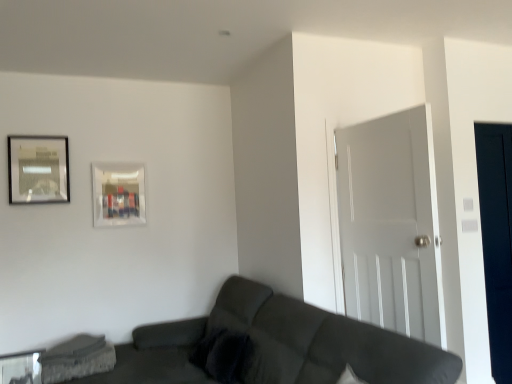
Describe the element at coordinates (21, 368) in the screenshot. I see `transparent glass table at lower left` at that location.

What do you see at coordinates (118, 194) in the screenshot? I see `matte glass picture frame at upper center, acting as the 2th picture frame starting from the front` at bounding box center [118, 194].

Locate an element on the screen. The height and width of the screenshot is (384, 512). white matte door at right is located at coordinates (391, 224).

Is transparent glass table at lower left located outside velvety dark gray pillow at lower center?

Yes, transparent glass table at lower left is not within velvety dark gray pillow at lower center.

Is transparent glass table at lower left oriented towards velvety dark gray pillow at lower center?

No, transparent glass table at lower left does not turn towards velvety dark gray pillow at lower center.

Find the location of `pillow lying above the transparent glass table at lower left (from the image's perspective)`. pillow lying above the transparent glass table at lower left (from the image's perspective) is located at coordinates (227, 355).

How far apart are transparent glass table at lower left and velvety dark gray pillow at lower center?

4.21 feet.

Locate an element on the screen. door in front of the velvety dark gray pillow at lower center is located at coordinates (391, 224).

Considering the points (239, 367) and (345, 176), which point is in front, point (239, 367) or point (345, 176)?

Positioned in front is point (239, 367).

Is velvety dark gray pillow at lower center far away from white matte door at right?

Indeed, velvety dark gray pillow at lower center is not near white matte door at right.

Between velvety dark gray pillow at lower center and white matte door at right, which one appears on the right side from the viewer's perspective?

Positioned to the right is white matte door at right.

Based on the photo, which object is closer to the camera, matte glass picture frame at upper center, placed as the 1th picture frame when sorted from right to left, or dark gray fabric couch at lower center?

dark gray fabric couch at lower center is in front.

Which object is wider, matte glass picture frame at upper center, placed as the 1th picture frame when sorted from back to front, or dark gray fabric couch at lower center?

dark gray fabric couch at lower center.

Is dark gray fabric couch at lower center surrounded by matte glass picture frame at upper center, acting as the 2th picture frame starting from the front?

That's incorrect, dark gray fabric couch at lower center is not inside matte glass picture frame at upper center, acting as the 2th picture frame starting from the front.

Measure the distance from matte glass picture frame at upper center, placed as the 1th picture frame when sorted from back to front, to dark gray fabric couch at lower center.

matte glass picture frame at upper center, placed as the 1th picture frame when sorted from back to front, and dark gray fabric couch at lower center are 4.57 feet apart.

Considering the positions of points (58, 380) and (6, 373), is point (58, 380) farther from camera compared to point (6, 373)?

No, (58, 380) is closer to viewer.

Could you tell me if concrete textured swivel chair at lower left is turned towards transparent glass table at lower left?

No, concrete textured swivel chair at lower left is not turned towards transparent glass table at lower left.

Considering the positions of objects concrete textured swivel chair at lower left and transparent glass table at lower left in the image provided, who is more to the left, concrete textured swivel chair at lower left or transparent glass table at lower left?

Positioned to the left is transparent glass table at lower left.

Are concrete textured swivel chair at lower left and transparent glass table at lower left located far from each other?

Result: That's not correct — concrete textured swivel chair at lower left is a little close to transparent glass table at lower left.

Considering the relative sizes of matte glass picture frame at upper center, placed as the 1th picture frame when sorted from back to front, and metallic silver picture frame at upper left, placed as the 2th picture frame when sorted from right to left, in the image provided, is matte glass picture frame at upper center, placed as the 1th picture frame when sorted from back to front, wider than metallic silver picture frame at upper left, placed as the 2th picture frame when sorted from right to left,?

In fact, matte glass picture frame at upper center, placed as the 1th picture frame when sorted from back to front, might be narrower than metallic silver picture frame at upper left, placed as the 2th picture frame when sorted from right to left.

In terms of height, does matte glass picture frame at upper center, placed as the 1th picture frame when sorted from back to front, look taller or shorter compared to metallic silver picture frame at upper left, placed as the 2th picture frame when sorted from right to left?

In the image, matte glass picture frame at upper center, placed as the 1th picture frame when sorted from back to front, appears to be shorter than metallic silver picture frame at upper left, placed as the 2th picture frame when sorted from right to left.

Is matte glass picture frame at upper center, marked as the 2th picture frame in a left-to-right arrangement, surrounding metallic silver picture frame at upper left, marked as the 2th picture frame in a back-to-front arrangement?

No, metallic silver picture frame at upper left, marked as the 2th picture frame in a back-to-front arrangement, is not inside matte glass picture frame at upper center, marked as the 2th picture frame in a left-to-right arrangement.

Considering their positions, is matte glass picture frame at upper center, placed as the 1th picture frame when sorted from back to front, located in front of or behind metallic silver picture frame at upper left, placed as the 2th picture frame when sorted from right to left?

Visually, matte glass picture frame at upper center, placed as the 1th picture frame when sorted from back to front, is located behind metallic silver picture frame at upper left, placed as the 2th picture frame when sorted from right to left.

The image size is (512, 384). Identify the location of swivel chair on the left side of matte glass picture frame at upper center, marked as the 2th picture frame in a left-to-right arrangement. (77, 358).

Is concrete textured swivel chair at lower left in front of or behind matte glass picture frame at upper center, acting as the 2th picture frame starting from the front, in the image?

concrete textured swivel chair at lower left is in front of matte glass picture frame at upper center, acting as the 2th picture frame starting from the front.

Does point (100, 356) lie in front of point (114, 216)?

Yes, it is.

Is there a large distance between concrete textured swivel chair at lower left and matte glass picture frame at upper center, placed as the 1th picture frame when sorted from right to left?

Yes, concrete textured swivel chair at lower left and matte glass picture frame at upper center, placed as the 1th picture frame when sorted from right to left, are quite far apart.

Is concrete textured swivel chair at lower left oriented away from white matte door at right?

No, concrete textured swivel chair at lower left's orientation is not away from white matte door at right.

Is concrete textured swivel chair at lower left at the right side of white matte door at right?

No.

Is there a large distance between concrete textured swivel chair at lower left and white matte door at right?

Yes.

Is the position of concrete textured swivel chair at lower left less distant than that of white matte door at right?

No, the depth of concrete textured swivel chair at lower left is greater than that of white matte door at right.

Find the location of a particular element. The width and height of the screenshot is (512, 384). glass table behind the velvety dark gray pillow at lower center is located at coordinates [x=21, y=368].

This screenshot has width=512, height=384. Find the location of `door in front of the velvety dark gray pillow at lower center`. door in front of the velvety dark gray pillow at lower center is located at coordinates (391, 224).

Considering their positions, is white matte door at right positioned closer to velvety dark gray pillow at lower center than dark gray fabric couch at lower center?

Based on the image, dark gray fabric couch at lower center appears to be nearer to velvety dark gray pillow at lower center.

Which object lies further to the anchor point transparent glass table at lower left, concrete textured swivel chair at lower left or transparent glass door at right?

transparent glass door at right lies further to transparent glass table at lower left than the other object.

From the image, which object appears to be farther from metallic silver picture frame at upper left, marked as the first picture frame in a left-to-right arrangement, dark gray fabric couch at lower center or transparent glass table at lower left?

dark gray fabric couch at lower center is positioned further to the anchor metallic silver picture frame at upper left, marked as the first picture frame in a left-to-right arrangement.

Estimate the real-world distances between objects in this image. Which object is further from dark gray fabric couch at lower center, white matte door at right or transparent glass door at right?

Based on the image, transparent glass door at right appears to be further to dark gray fabric couch at lower center.

Which object lies nearer to the anchor point velvety dark gray pillow at lower center, transparent glass door at right or white matte door at right?

white matte door at right.

Looking at the image, which one is located further to white matte door at right, concrete textured swivel chair at lower left or metallic silver picture frame at upper left, marked as the 2th picture frame in a back-to-front arrangement?

metallic silver picture frame at upper left, marked as the 2th picture frame in a back-to-front arrangement, is positioned further to the anchor white matte door at right.

Estimate the real-world distances between objects in this image. Which object is further from matte glass picture frame at upper center, placed as the 1th picture frame when sorted from back to front, white matte door at right or metallic silver picture frame at upper left, acting as the 1th picture frame starting from the front?

white matte door at right is further to matte glass picture frame at upper center, placed as the 1th picture frame when sorted from back to front.

When comparing their distances from transparent glass table at lower left, does metallic silver picture frame at upper left, marked as the first picture frame in a left-to-right arrangement, or dark gray fabric couch at lower center seem further?

dark gray fabric couch at lower center lies further to transparent glass table at lower left than the other object.

I want to click on picture frame situated between metallic silver picture frame at upper left, placed as the 2th picture frame when sorted from right to left, and white matte door at right from left to right, so click(118, 194).

This screenshot has width=512, height=384. Find the location of `picture frame between concrete textured swivel chair at lower left and white matte door at right from left to right`. picture frame between concrete textured swivel chair at lower left and white matte door at right from left to right is located at coordinates (118, 194).

Locate an element on the screen. studio couch between concrete textured swivel chair at lower left and white matte door at right is located at coordinates (280, 345).

Where is `studio couch between matte glass picture frame at upper center, placed as the 1th picture frame when sorted from back to front, and transparent glass door at right, in the horizontal direction`? studio couch between matte glass picture frame at upper center, placed as the 1th picture frame when sorted from back to front, and transparent glass door at right, in the horizontal direction is located at coordinates (280, 345).